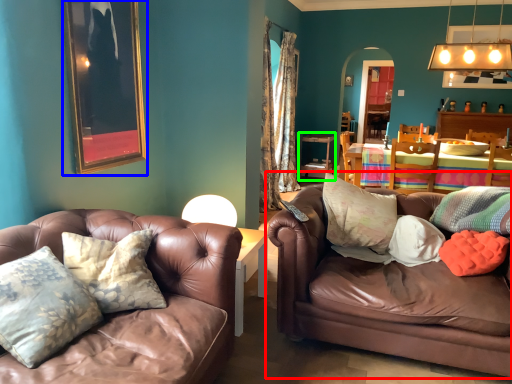
Question: Which object is the farthest from studio couch (highlighted by a red box)? Choose among these: picture frame (highlighted by a blue box) or table (highlighted by a green box).

Choices:
 (A) picture frame
 (B) table

Answer: (B)